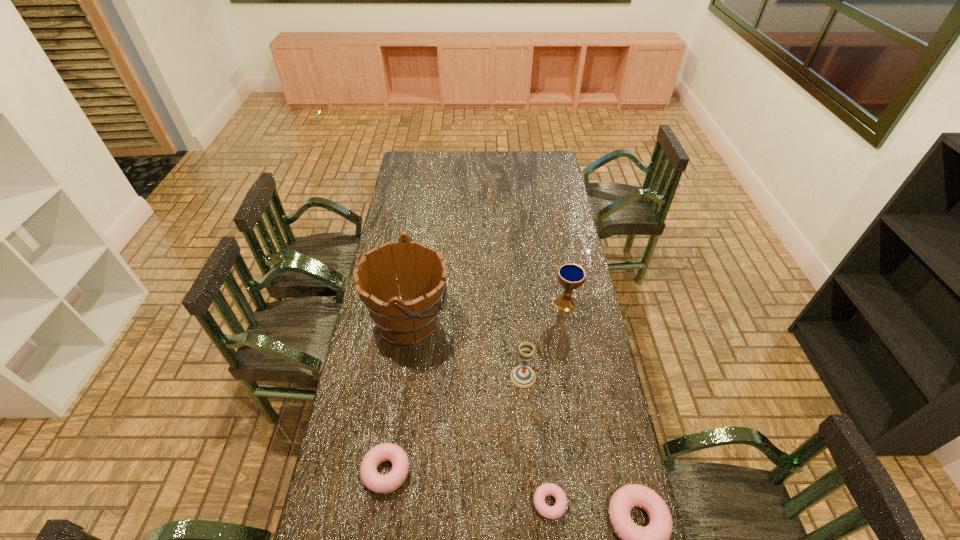
Identify the location of the second tallest doughnut. (371, 479).

Identify the location of the fifth tallest object. (371, 479).

Where is `the second doughnut from right to left`? The height and width of the screenshot is (540, 960). the second doughnut from right to left is located at coordinates (554, 512).

You are a GUI agent. You are given a task and a screenshot of the screen. Output one action in this format:
    pyautogui.click(x=<x>, y=<y>)
    Task: Click on the shortest doughnut
    Image resolution: width=960 pixels, height=540 pixels.
    Given the screenshot: What is the action you would take?
    pyautogui.click(x=554, y=512)

Find the location of a particular element. This screenshot has height=540, width=960. wine bucket is located at coordinates (412, 318).

The image size is (960, 540). What are the coordinates of `the fourth nearest object` in the screenshot? It's located at (522, 376).

The height and width of the screenshot is (540, 960). Identify the location of the left chalice. (522, 376).

In order to click on the farther chalice in this screenshot , I will do `click(571, 276)`.

At what (x,y) coordinates should I click in order to perform the action: click on vacant space positioned on the back of the leftmost doughnut. Please return your answer as a coordinate pair (x, y). This screenshot has width=960, height=540. Looking at the image, I should click on (394, 423).

You are a GUI agent. You are given a task and a screenshot of the screen. Output one action in this format:
    pyautogui.click(x=<x>, y=<y>)
    Task: Click on the vacant position located on the right of the second doughnut from left to right
    The height and width of the screenshot is (540, 960).
    Given the screenshot: What is the action you would take?
    pyautogui.click(x=628, y=503)